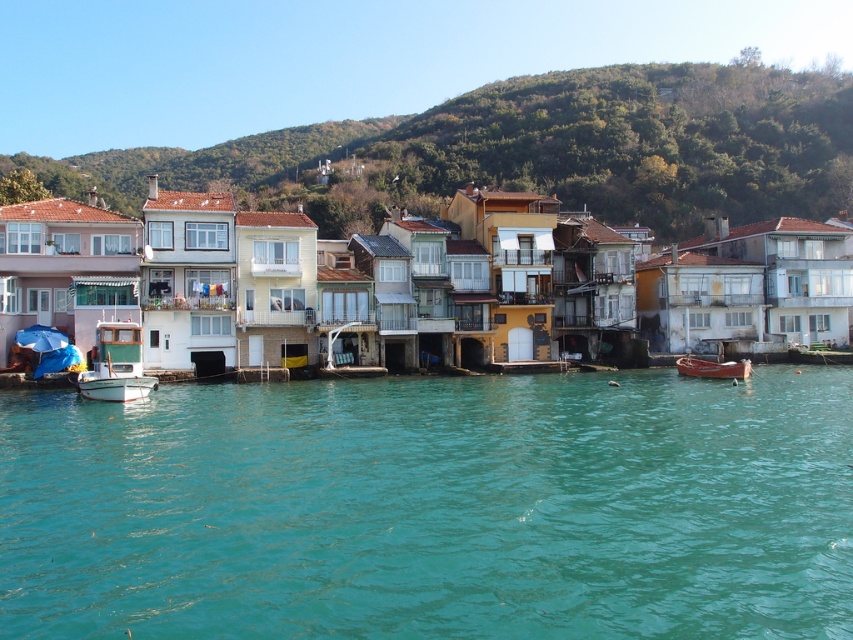
This screenshot has height=640, width=853. What do you see at coordinates (433, 508) in the screenshot?
I see `teal glossy water at center` at bounding box center [433, 508].

Which of these two, teal glossy water at center or white matte boat at left, stands taller?

white matte boat at left

Is point (746, 435) behind point (135, 396)?

No, it is in front of (135, 396).

I want to click on teal glossy water at center, so click(433, 508).

Does white matte boat at left appear on the right side of wooden boat at lower right?

No, white matte boat at left is not to the right of wooden boat at lower right.

Can you confirm if white matte boat at left is bigger than wooden boat at lower right?

Correct, white matte boat at left is larger in size than wooden boat at lower right.

Is point (103, 394) less distant than point (693, 364)?

Yes.

At what (x,y) coordinates should I click in order to perform the action: click on white matte boat at left. Please return your answer as a coordinate pair (x, y). This screenshot has width=853, height=640. Looking at the image, I should click on (115, 364).

Who is positioned more to the right, green leafy hillside at upper center or white matte boat at left?

white matte boat at left is more to the right.

Which is above, green leafy hillside at upper center or white matte boat at left?

green leafy hillside at upper center is above.

This screenshot has width=853, height=640. I want to click on green leafy hillside at upper center, so click(x=538, y=148).